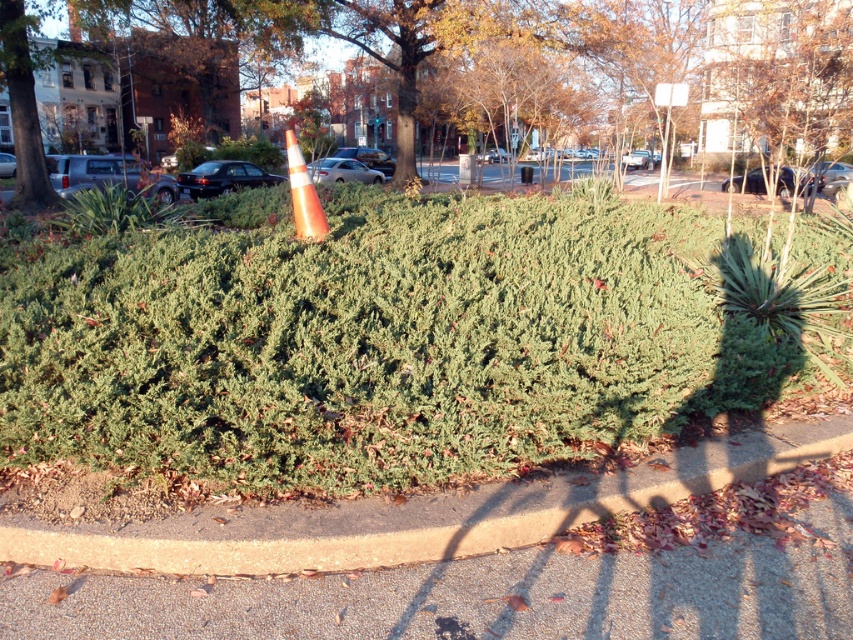
Question: Which point is closer to the camera taking this photo?

Choices:
 (A) (518, 38)
 (B) (296, 168)
 (C) (618, 481)

Answer: (C)

Question: Is concrete curb at lower center smaller than orange reflective cone at center?

Choices:
 (A) yes
 (B) no

Answer: (A)

Question: Which of the following is the farthest from the observer?

Choices:
 (A) concrete curb at lower center
 (B) green leafy bush at center
 (C) orange reflective cone at center

Answer: (B)

Question: Which point is closer to the camera taking this photo?

Choices:
 (A) (286, 145)
 (B) (184, 531)
 (C) (494, 1)

Answer: (B)

Question: Can you confirm if concrete curb at lower center is positioned to the left of orange reflective cone at center?

Choices:
 (A) yes
 (B) no

Answer: (B)

Question: Is the position of green leafy bush at center more distant than that of concrete curb at lower center?

Choices:
 (A) yes
 (B) no

Answer: (A)